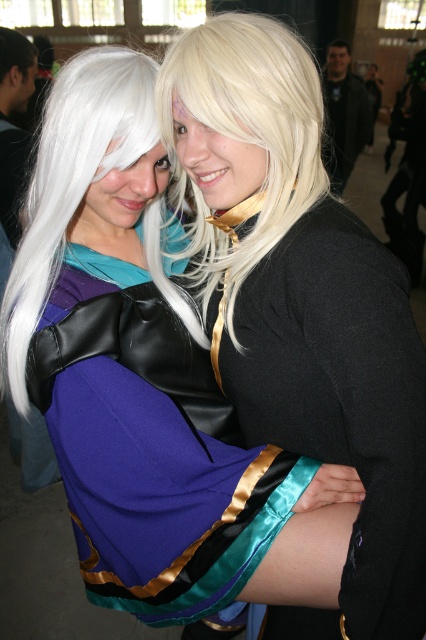
Between purple satin dress at center and blonde silky hair at upper center, which one appears on the left side from the viewer's perspective?

purple satin dress at center is more to the left.

Who is positioned more to the right, purple satin dress at center or blonde silky hair at upper center?

A: Positioned to the right is blonde silky hair at upper center.

Measure the distance between purple satin dress at center and camera.

purple satin dress at center and camera are 37.49 inches apart.

You are a GUI agent. You are given a task and a screenshot of the screen. Output one action in this format:
    pyautogui.click(x=<x>, y=<y>)
    Task: Click on the purple satin dress at center
    
    Given the screenshot: What is the action you would take?
    pyautogui.click(x=164, y=492)

Between point (227, 115) and point (5, 358), which one is positioned in front?

Positioned in front is point (227, 115).

Is point (181, 70) more distant than point (19, 253)?

No, it is not.

Is point (287, 97) positioned in front of point (5, 374)?

Yes, it is.

You are a GUI agent. You are given a task and a screenshot of the screen. Output one action in this format:
    pyautogui.click(x=<x>, y=<y>)
    Task: Click on the blonde silky hair at upper center
    This screenshot has width=426, height=640.
    Given the screenshot: What is the action you would take?
    pyautogui.click(x=247, y=132)

Which is behind, point (325, 276) or point (279, 184)?

The point (279, 184) is more distant.

In the scene shown: Does satin black dress at center lie in front of blonde silky hair at upper center?

Yes, satin black dress at center is in front of blonde silky hair at upper center.

Is point (201, 193) closer to viewer compared to point (210, 205)?

No, (201, 193) is further to viewer.

Identify the location of satin black dress at center. (304, 300).